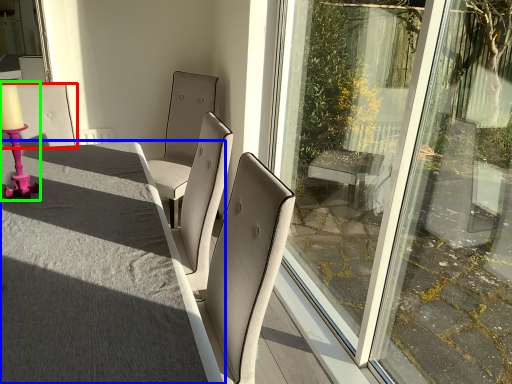
Question: Considering the real-world distances, which object is farthest from chair (highlighted by a red box)? table (highlighted by a blue box) or candle holder (highlighted by a green box)?

Choices:
 (A) table
 (B) candle holder

Answer: (A)